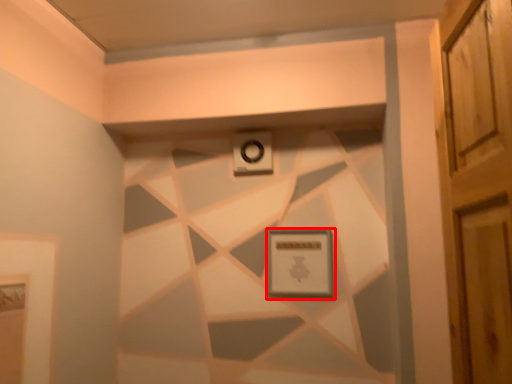
Question: From the image's perspective, where is picture frame (annotated by the red box) located relative to alarm?

Choices:
 (A) below
 (B) above

Answer: (A)